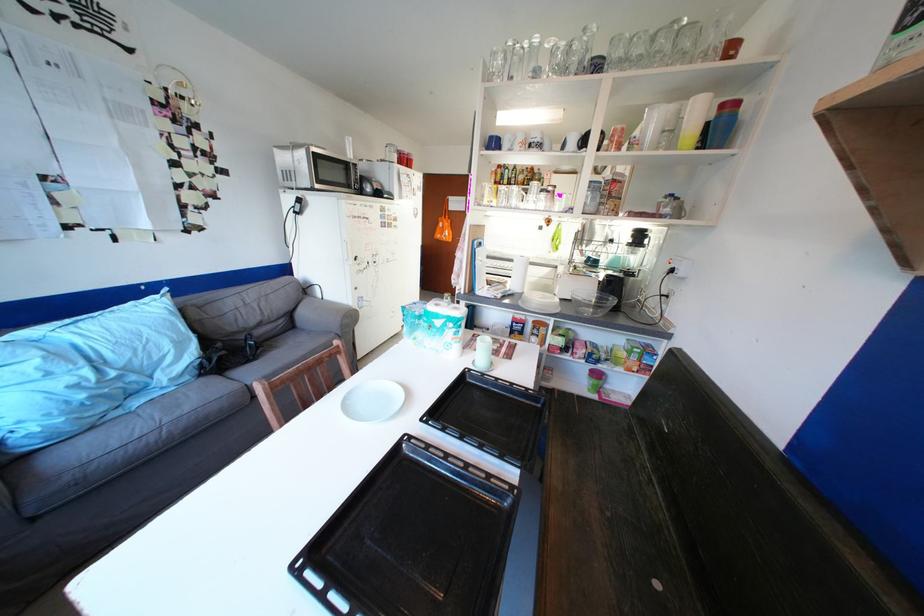
You are a GUI agent. You are given a task and a screenshot of the screen. Output one action in this format:
    pyautogui.click(x=<x>, y=<y>)
    Task: Click on the paper towel roll
    This screenshot has height=616, width=924.
    Given the screenshot: What is the action you would take?
    pyautogui.click(x=517, y=274)